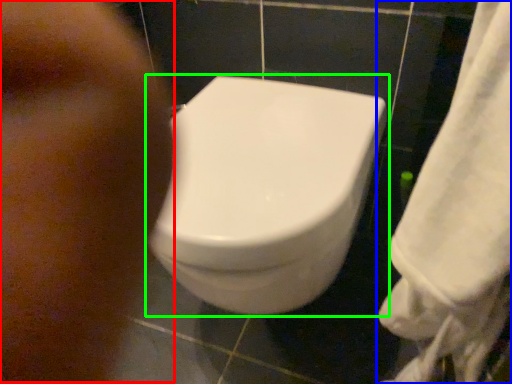
Question: Based on their relative distances, which object is nearer to face (highlighted by a red box)? Choose from towel (highlighted by a blue box) and toilet (highlighted by a green box).

Choices:
 (A) towel
 (B) toilet

Answer: (B)